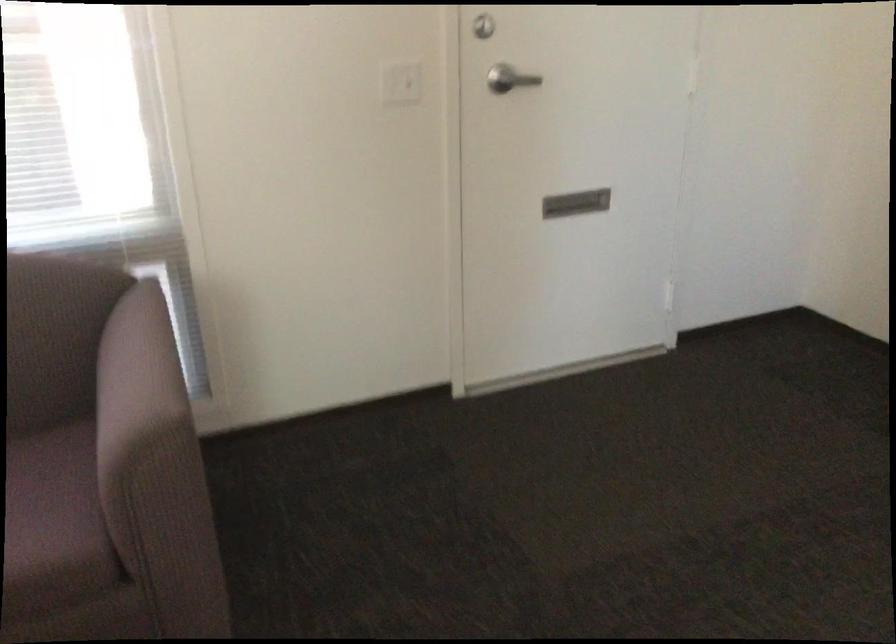
Find where to turn the silver door handle. Please return your answer as a coordinate pair (x, y).

(510, 79)